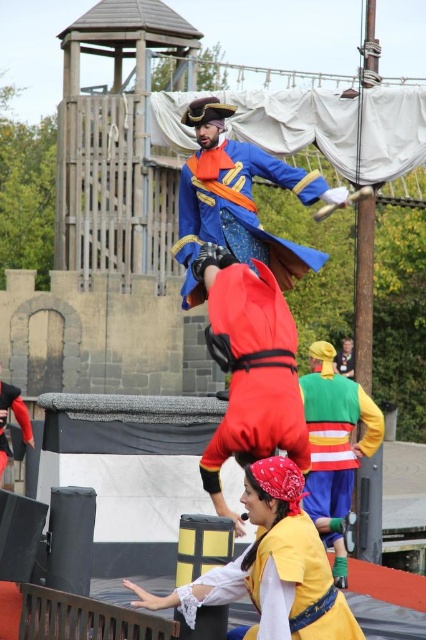
Find the location of a particular element. This screenshot has height=640, width=426. multicolored fabric costume at center is located at coordinates (336, 438).

Is multicolored fabric costume at center to the right of matte black costume at lower left from the viewer's perspective?

Correct, you'll find multicolored fabric costume at center to the right of matte black costume at lower left.

Who is more forward, (333,532) or (19,420)?

Point (333,532) is more forward.

Image resolution: width=426 pixels, height=640 pixels. What are the coordinates of `multicolored fabric costume at center` in the screenshot? It's located at (336, 438).

Does shiny red fabric at center have a greater height compared to matte black costume at lower left?

Indeed, shiny red fabric at center has a greater height compared to matte black costume at lower left.

Does point (259, 419) come in front of point (11, 400)?

Yes, it is in front of point (11, 400).

Locate an element on the screen. The width and height of the screenshot is (426, 640). shiny red fabric at center is located at coordinates (253, 371).

Is blue velvet coat at center to the left of matte black costume at lower left from the viewer's perspective?

In fact, blue velvet coat at center is to the right of matte black costume at lower left.

Does blue velvet coat at center have a greater height compared to matte black costume at lower left?

Correct, blue velvet coat at center is much taller as matte black costume at lower left.

What are the coordinates of `blue velvet coat at center` in the screenshot? It's located at (238, 212).